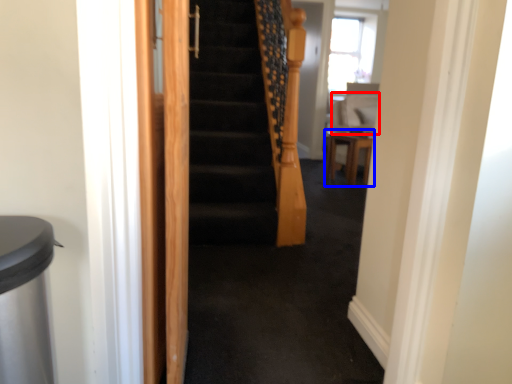
Question: Among these objects, which one is nearest to the camera, sit (highlighted by a red box) or furniture (highlighted by a blue box)?

Choices:
 (A) sit
 (B) furniture

Answer: (B)